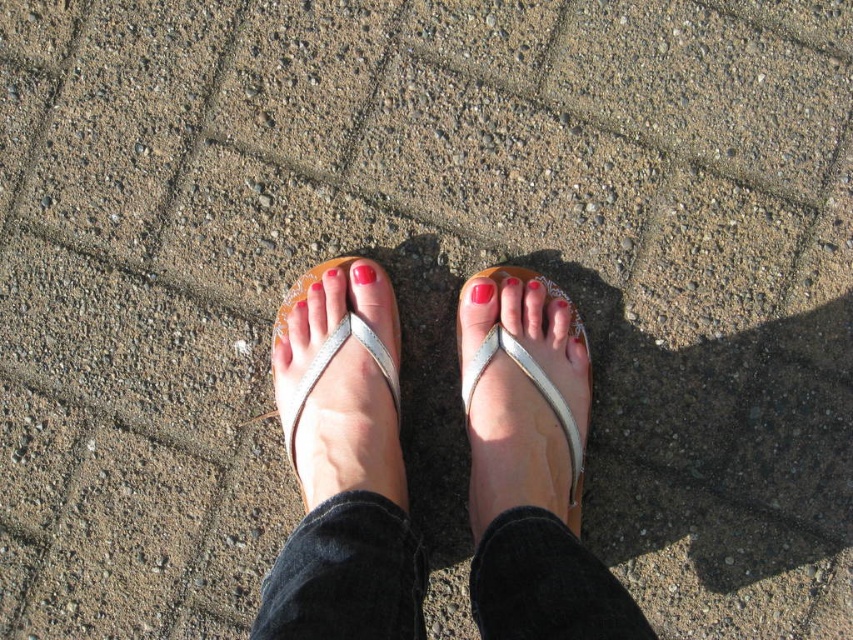
What object is located at the coordinates point [341,467] in the image?

The shiny metallic sandals at center is located at point [341,467].

From the picture: What are the coordinates of the shiny metallic sandals at center?

The shiny metallic sandals at center are located at coordinates point (341, 467).